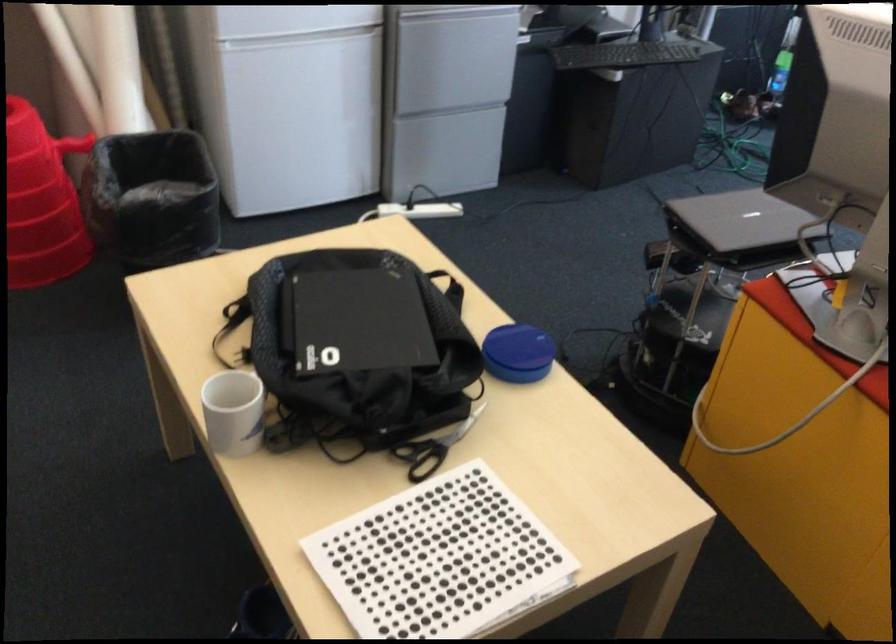
The location [739,220] corresponds to which object?

It refers to a silver laptop.